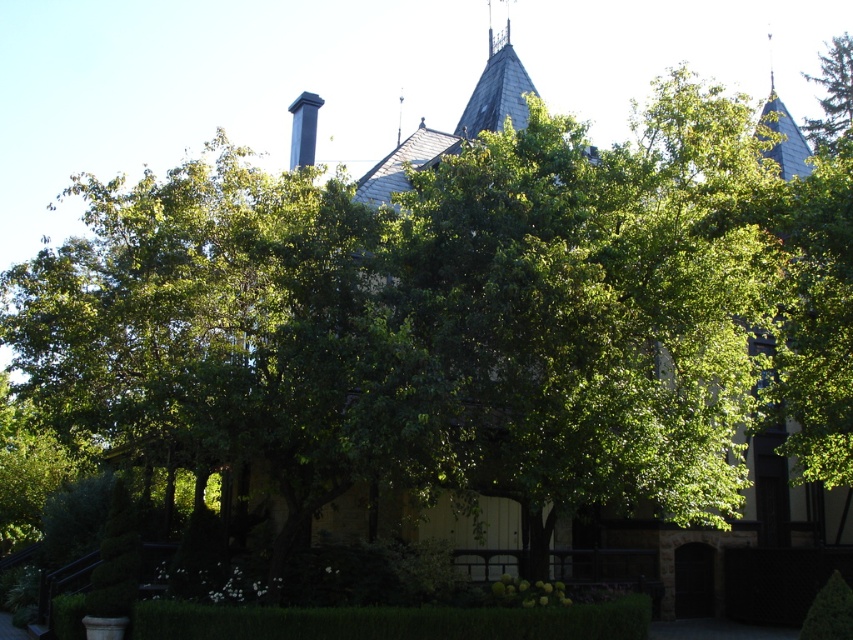
Can you confirm if dark gray slate chimney at upper center is taller than green leafy tree at upper right?

In fact, dark gray slate chimney at upper center may be shorter than green leafy tree at upper right.

Does dark gray slate chimney at upper center have a lesser height compared to green leafy tree at upper right?

Yes.

Who is more forward, (483,106) or (816,132)?

Point (483,106) is more forward.

Identify the location of dark gray slate chimney at upper center. (497, 90).